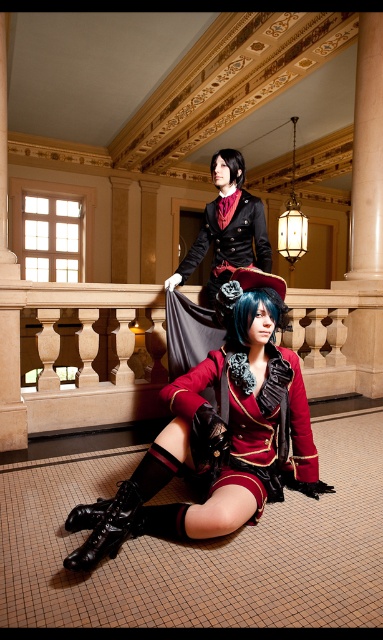
Question: Observing the image, what is the correct spatial positioning of blue matte hair at center in reference to black matte hair at upper center?

Choices:
 (A) above
 (B) below

Answer: (B)

Question: Estimate the real-world distances between objects in this image. Which object is closer to the matte black coat at upper center?

Choices:
 (A) velvet red coat at center
 (B) blue matte hair at center
 (C) black leather boot at lower left
 (D) black matte hair at upper center

Answer: (D)

Question: Is blue matte hair at center to the right of black matte hair at upper center from the viewer's perspective?

Choices:
 (A) yes
 (B) no

Answer: (B)

Question: In this image, where is matte black coat at upper center located relative to black matte hair at upper center?

Choices:
 (A) below
 (B) above

Answer: (A)

Question: Estimate the real-world distances between objects in this image. Which object is farther from the blue matte hair at center?

Choices:
 (A) velvet red coat at center
 (B) black leather boot at lower left

Answer: (B)

Question: Estimate the real-world distances between objects in this image. Which object is closer to the matte black coat at upper center?

Choices:
 (A) blue matte hair at center
 (B) black leather boot at lower left
 (C) black matte hair at upper center
 (D) velvet red coat at center

Answer: (C)